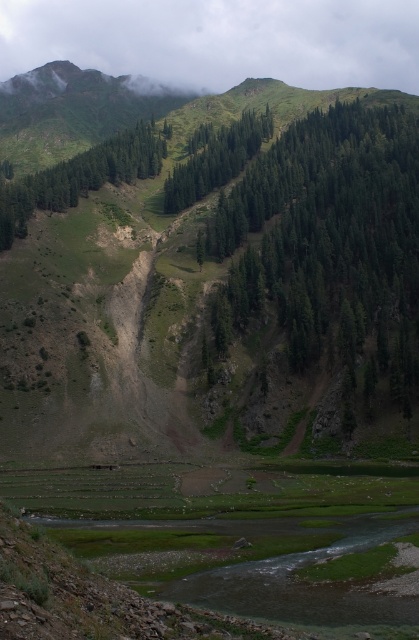
Which is below, cloudy green at upper center or green matte tree at upper left?

green matte tree at upper left is below.

Is cloudy green at upper center shorter than green matte tree at upper left?

No.

Which is behind, point (328, 52) or point (62, 189)?

Positioned behind is point (328, 52).

The width and height of the screenshot is (419, 640). Find the location of `cloudy green at upper center`. cloudy green at upper center is located at coordinates (219, 40).

Can you confirm if green textured trees at upper center is shorter than green matte tree at center?

In fact, green textured trees at upper center may be taller than green matte tree at center.

Does green textured trees at upper center appear under green matte tree at center?

Yes, green textured trees at upper center is below green matte tree at center.

Where is `green textured trees at upper center`? This screenshot has height=640, width=419. green textured trees at upper center is located at coordinates (328, 259).

Can you confirm if cloudy green at upper center is thinner than green matte tree at center?

Incorrect, cloudy green at upper center's width is not less than green matte tree at center's.

Which is below, cloudy green at upper center or green matte tree at center?

green matte tree at center is lower down.

Describe the element at coordinates (219, 40) in the screenshot. I see `cloudy green at upper center` at that location.

You are a GUI agent. You are given a task and a screenshot of the screen. Output one action in this format:
    pyautogui.click(x=<x>, y=<y>)
    Task: Click on the cloudy green at upper center
    
    Given the screenshot: What is the action you would take?
    pyautogui.click(x=219, y=40)